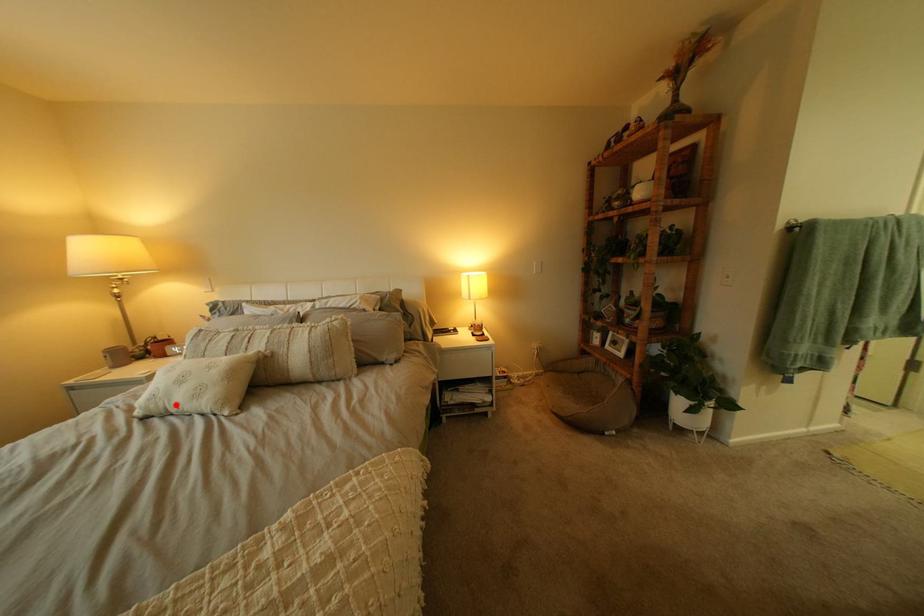
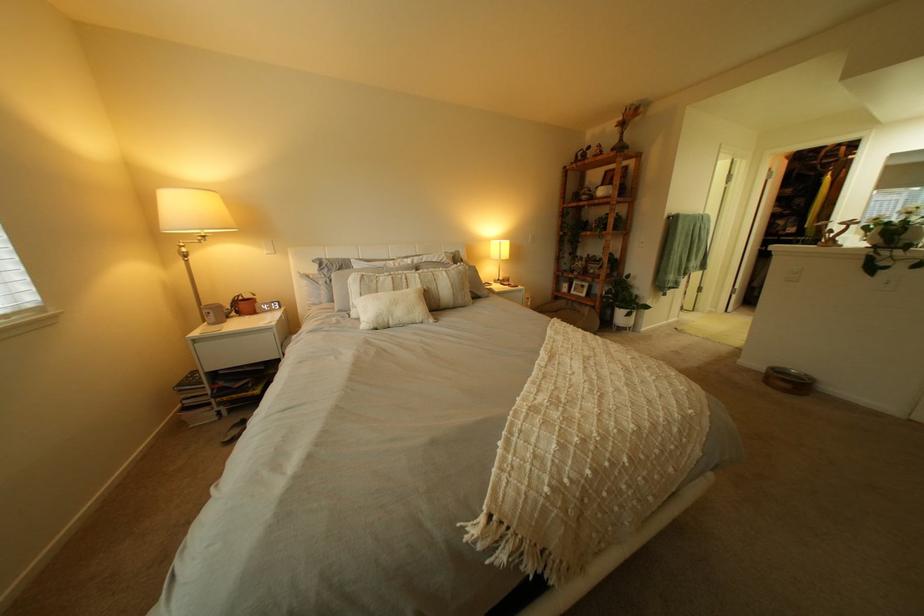
Find the pixel in the second image that matches the highlighted location in the first image.

(400, 320)